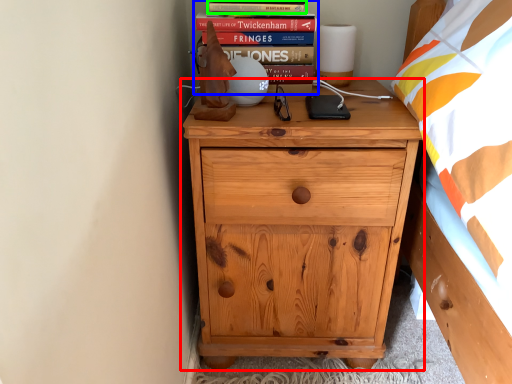
Question: Based on their relative distances, which object is nearer to chest of drawers (highlighted by a red box)? Choose from book (highlighted by a blue box) and paperback book (highlighted by a green box).

Choices:
 (A) book
 (B) paperback book

Answer: (A)